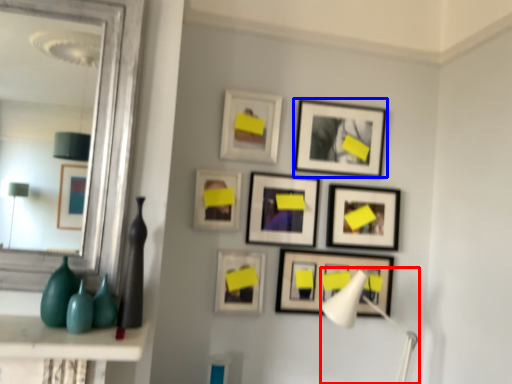
Question: Which object is closer to the camera taking this photo, table lamp (highlighted by a red box) or picture frame (highlighted by a blue box)?

Choices:
 (A) table lamp
 (B) picture frame

Answer: (A)